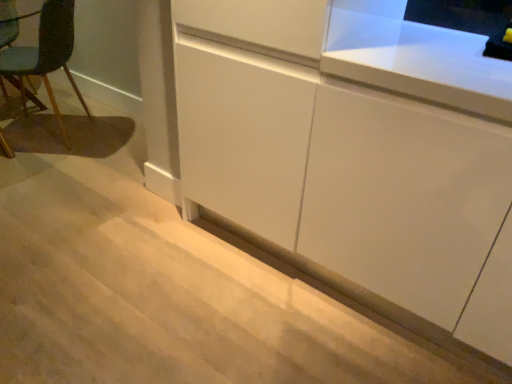
Question: Is white matte cabinet at center, which is counted as the 2th cabinetry, starting from the left, wider or thinner than teal fabric chair at left?

Choices:
 (A) wide
 (B) thin

Answer: (A)

Question: In terms of height, does white matte cabinet at center, which is counted as the 2th cabinetry, starting from the left, look taller or shorter compared to teal fabric chair at left?

Choices:
 (A) short
 (B) tall

Answer: (B)

Question: Which object is positioned farthest from the white matte cabinet at lower center, the second cabinetry from the right?

Choices:
 (A) teal fabric chair at left
 (B) white matte cabinet at center, positioned as the 1th cabinetry in right-to-left order

Answer: (A)

Question: Which of these objects is positioned closest to the white matte cabinet at lower center, which is counted as the first cabinetry, starting from the left?

Choices:
 (A) teal fabric chair at left
 (B) white matte cabinet at center, positioned as the 1th cabinetry in right-to-left order

Answer: (B)